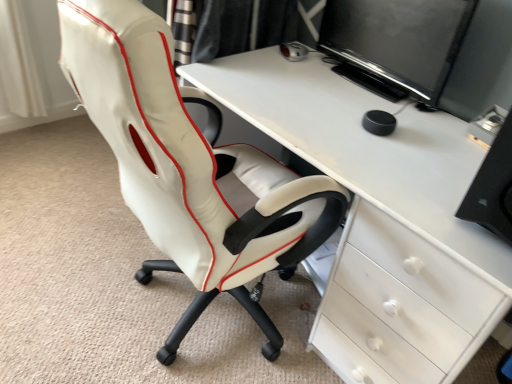
You are a GUI agent. You are given a task and a screenshot of the screen. Output one action in this format:
    pyautogui.click(x=<x>, y=<y>)
    Task: Click on the free space in front of black glossy monitor at upper right
    
    Given the screenshot: What is the action you would take?
    click(x=373, y=110)